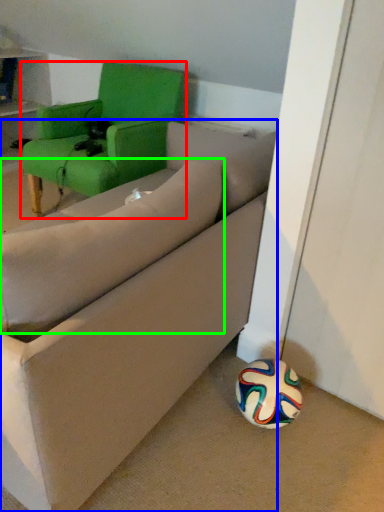
Question: Which is nearer to the chair (highlighted by a red box)? studio couch (highlighted by a blue box) or pillow (highlighted by a green box).

Choices:
 (A) studio couch
 (B) pillow

Answer: (A)